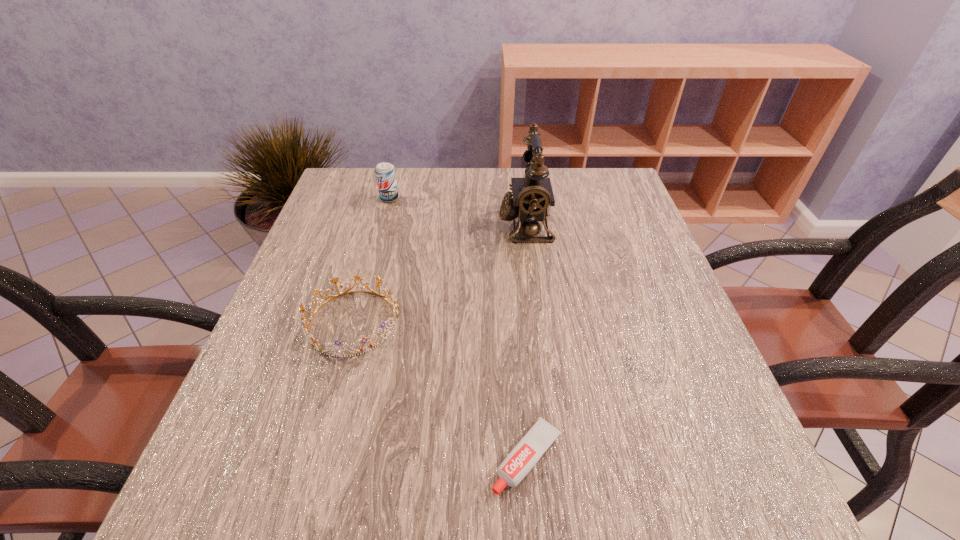
Locate an element on the screen. vacant space that's between the second tallest object and the toothpaste is located at coordinates (458, 328).

Identify the location of free point between the second tallest object and the telephone. (457, 212).

At what (x,y) coordinates should I click in order to perform the action: click on empty space that is in between the third tallest object and the toothpaste. Please return your answer as a coordinate pair (x, y). Looking at the image, I should click on (440, 390).

Locate an element on the screen. vacant space that's between the second nearest object and the tallest object is located at coordinates (439, 273).

Image resolution: width=960 pixels, height=540 pixels. Identify the location of vacant area that lies between the telephone and the third shortest object. (457, 212).

Find the location of a particular element. This screenshot has width=960, height=540. vacant point located between the tiara and the tallest object is located at coordinates (439, 273).

Identify which object is located as the second nearest to the nearest object. Please provide its 2D coordinates. Your answer should be formatted as a tuple, i.e. [(x, y)], where the tuple contains the x and y coordinates of a point satisfying the conditions above.

[(530, 201)]

Locate an element on the screen. object that is the second closest to the second nearest object is located at coordinates (530, 201).

The image size is (960, 540). In order to click on vacant position in the image that satisfies the following two spatial constraints: 1. on the front-facing side of the toothpaste; 2. on the right side of the third farthest object in this screenshot , I will do `click(315, 458)`.

At what (x,y) coordinates should I click in order to perform the action: click on vacant space that satisfies the following two spatial constraints: 1. on the front-facing side of the third tallest object; 2. on the back side of the shortest object. Please return your answer as a coordinate pair (x, y). Looking at the image, I should click on (315, 458).